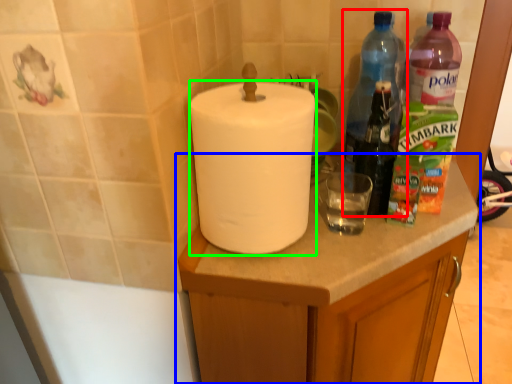
Question: Based on their relative distances, which object is nearer to bottle (highlighted by a red box)? Choose from cabinetry (highlighted by a blue box) and paper towel (highlighted by a green box).

Choices:
 (A) cabinetry
 (B) paper towel

Answer: (A)